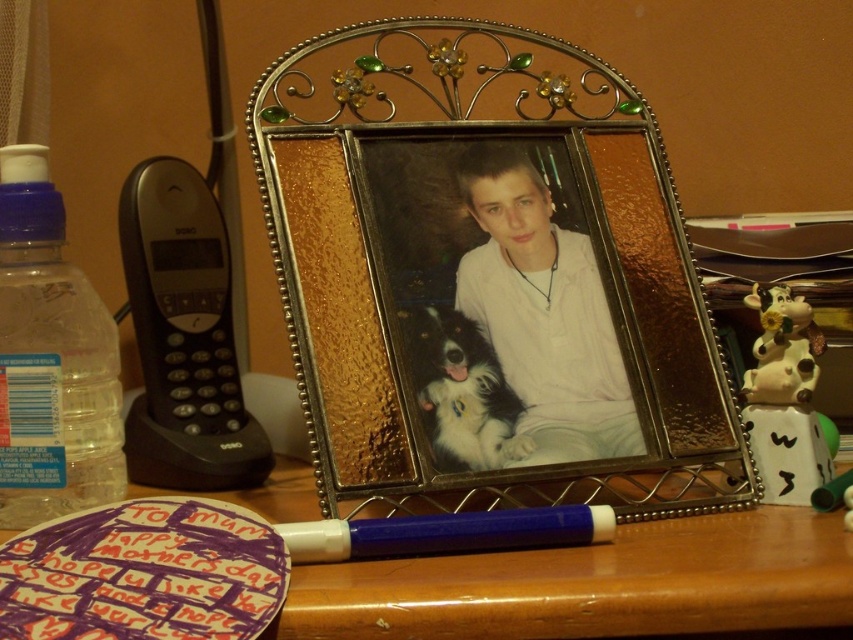
Question: Estimate the real-world distances between objects in this image. Which object is farther from the white plastic pen at center?

Choices:
 (A) metallic gold picture frame at center
 (B) translucent plastic bottle at left
 (C) wooden table at center
 (D) fluffy white dog at center

Answer: (B)

Question: Does metallic gold picture frame at center have a greater width compared to white matte shirt at center?

Choices:
 (A) no
 (B) yes

Answer: (B)

Question: Is metallic gold picture frame at center positioned at the back of translucent plastic bottle at left?

Choices:
 (A) yes
 (B) no

Answer: (B)

Question: Which point is farther from the camera taking this photo?

Choices:
 (A) (16, 344)
 (B) (602, 250)
 (C) (508, 280)

Answer: (B)

Question: Is white matte shirt at center to the left of fluffy white dog at center from the viewer's perspective?

Choices:
 (A) no
 (B) yes

Answer: (A)

Question: Which object appears closest to the camera in this image?

Choices:
 (A) metallic gold picture frame at center
 (B) white plastic pen at center
 (C) wooden table at center

Answer: (C)